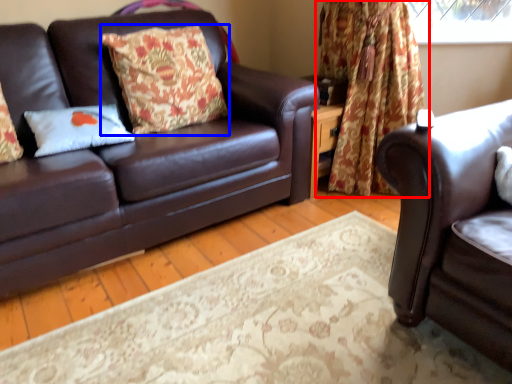
Question: Which object appears closest to the camera in this image, curtain (highlighted by a red box) or pillow (highlighted by a blue box)?

Choices:
 (A) curtain
 (B) pillow

Answer: (B)